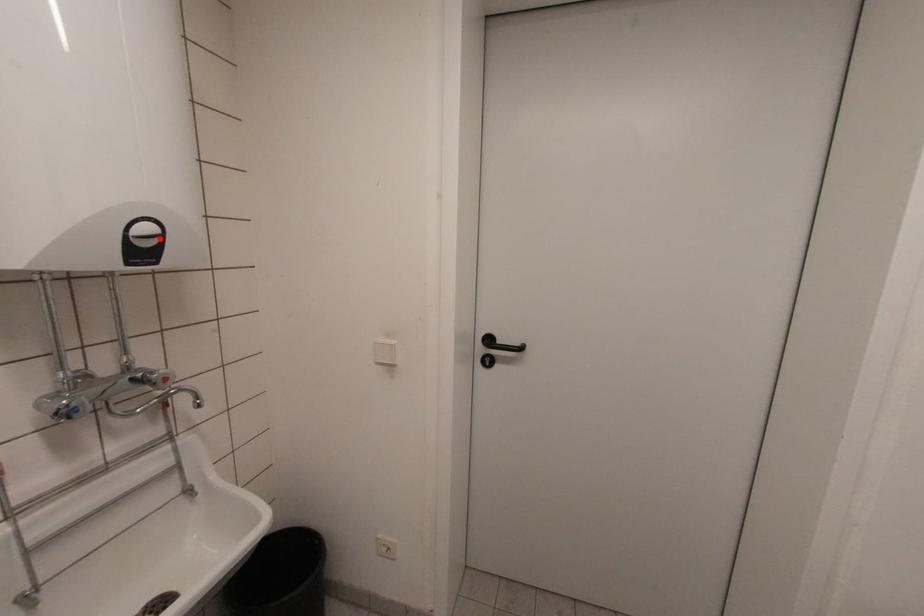
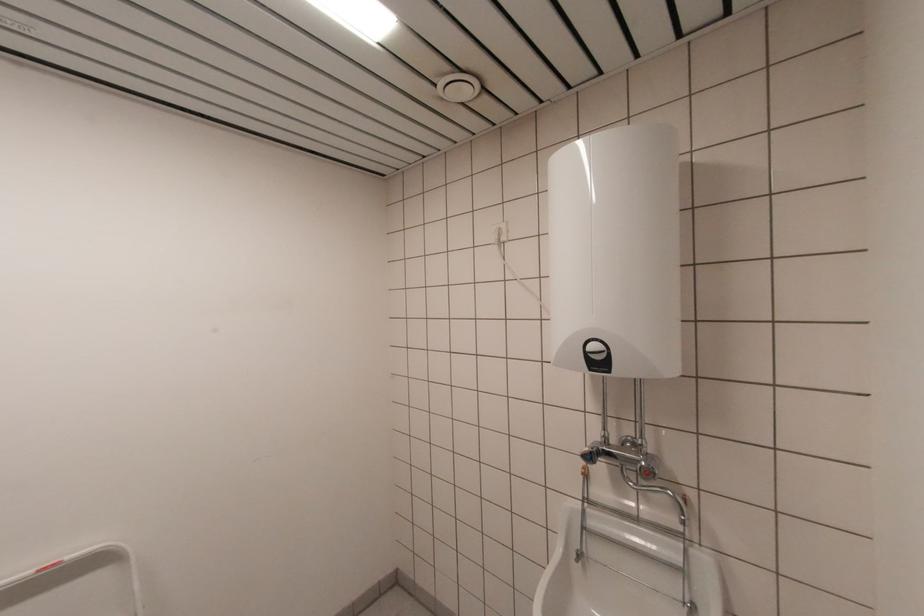
In the second image, find the point that corresponds to the highlighted location in the first image.

(605, 354)